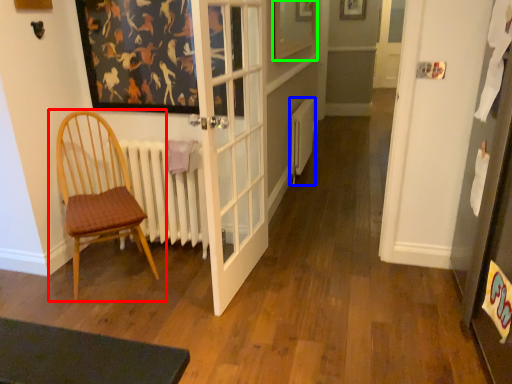
Question: Considering the real-world distances, which object is farthest from chair (highlighted by a red box)? heater (highlighted by a blue box) or picture frame (highlighted by a green box)?

Choices:
 (A) heater
 (B) picture frame

Answer: (A)